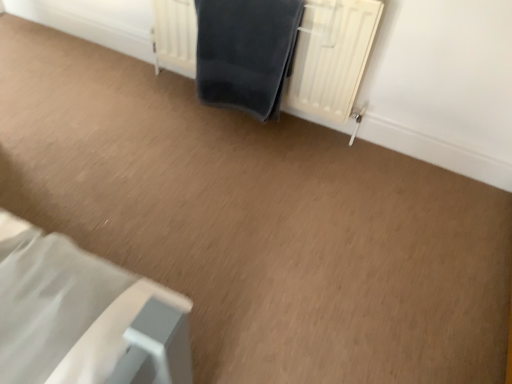
What is the approximate width of dark blue fabric at center?

The width of dark blue fabric at center is 7.52 inches.

Where is `dark blue fabric at center`? This screenshot has height=384, width=512. dark blue fabric at center is located at coordinates click(246, 53).

What do you see at coordinates (246, 53) in the screenshot? This screenshot has width=512, height=384. I see `dark blue fabric at center` at bounding box center [246, 53].

Describe the element at coordinates (332, 56) in the screenshot. I see `white textured radiator at upper center` at that location.

Image resolution: width=512 pixels, height=384 pixels. I want to click on white textured radiator at upper center, so click(x=332, y=56).

What are the coordinates of `dark blue fabric at center` in the screenshot? It's located at (246, 53).

Considering the relative positions of dark blue fabric at center and white textured radiator at upper center in the image provided, is dark blue fabric at center to the left or to the right of white textured radiator at upper center?

Based on their positions, dark blue fabric at center is located to the left of white textured radiator at upper center.

Is dark blue fabric at center closer to the viewer compared to white textured radiator at upper center?

That is False.

Is point (223, 57) closer or farther from the camera than point (310, 42)?

Clearly, point (223, 57) is more distant from the camera than point (310, 42).

From the image's perspective, which object appears higher, dark blue fabric at center or white textured radiator at upper center?

white textured radiator at upper center.

Based on the photo, from a real-world perspective, is dark blue fabric at center positioned over white textured radiator at upper center based on gravity?

Yes, from a real-world perspective, dark blue fabric at center is on top of white textured radiator at upper center.

Is dark blue fabric at center thinner than white textured radiator at upper center?

Yes.

Considering the sizes of dark blue fabric at center and white textured radiator at upper center in the image, is dark blue fabric at center taller or shorter than white textured radiator at upper center?

Clearly, dark blue fabric at center is shorter compared to white textured radiator at upper center.

Can you confirm if dark blue fabric at center is smaller than white textured radiator at upper center?

Indeed, dark blue fabric at center has a smaller size compared to white textured radiator at upper center.

Is dark blue fabric at center located outside white textured radiator at upper center?

No, dark blue fabric at center is not outside of white textured radiator at upper center.

Is dark blue fabric at center with white textured radiator at upper center?

dark blue fabric at center and white textured radiator at upper center are not in contact.

Consider the image. Could you tell me if dark blue fabric at center is turned towards white textured radiator at upper center?

Yes, dark blue fabric at center is facing white textured radiator at upper center.

Can you tell me how much dark blue fabric at center and white textured radiator at upper center differ in facing direction?

They differ by 0.00142 degrees in their facing directions.

I want to click on bath towel on the left of white textured radiator at upper center, so click(x=246, y=53).

Is white textured radiator at upper center at the right side of dark blue fabric at center?

Indeed, white textured radiator at upper center is positioned on the right side of dark blue fabric at center.

Is white textured radiator at upper center closer to camera compared to dark blue fabric at center?

Yes, it is in front of dark blue fabric at center.

Considering the positions of point (187, 63) and point (273, 40), is point (187, 63) closer or farther from the camera than point (273, 40)?

Point (187, 63) is farther from the camera than point (273, 40).

In the scene shown: From the image's perspective, does white textured radiator at upper center appear higher than dark blue fabric at center?

Yes, from the image's perspective, white textured radiator at upper center is over dark blue fabric at center.

Looking at this image, from a real-world perspective, between white textured radiator at upper center and dark blue fabric at center, who is vertically higher?

From a 3D spatial view, dark blue fabric at center is above.

Considering the relative sizes of white textured radiator at upper center and dark blue fabric at center in the image provided, is white textured radiator at upper center thinner than dark blue fabric at center?

No, white textured radiator at upper center is not thinner than dark blue fabric at center.

Who is shorter, white textured radiator at upper center or dark blue fabric at center?

dark blue fabric at center is shorter.

Between white textured radiator at upper center and dark blue fabric at center, which one has larger size?

white textured radiator at upper center is bigger.

Is white textured radiator at upper center positioned beyond the bounds of dark blue fabric at center?

Absolutely, white textured radiator at upper center is external to dark blue fabric at center.

Are white textured radiator at upper center and dark blue fabric at center making contact?

No, white textured radiator at upper center is not beside dark blue fabric at center.

Is white textured radiator at upper center turned away from dark blue fabric at center?

Yes, white textured radiator at upper center's orientation is away from dark blue fabric at center.

Find the location of a particular element. The height and width of the screenshot is (384, 512). bath towel that appears above the white textured radiator at upper center (from a real-world perspective) is located at coordinates (246, 53).

What are the coordinates of `radiator to the right of dark blue fabric at center` in the screenshot? It's located at (332, 56).

In the image, there is a white textured radiator at upper center. What are the coordinates of `bath towel below it (from the image's perspective)` in the screenshot? It's located at (246, 53).